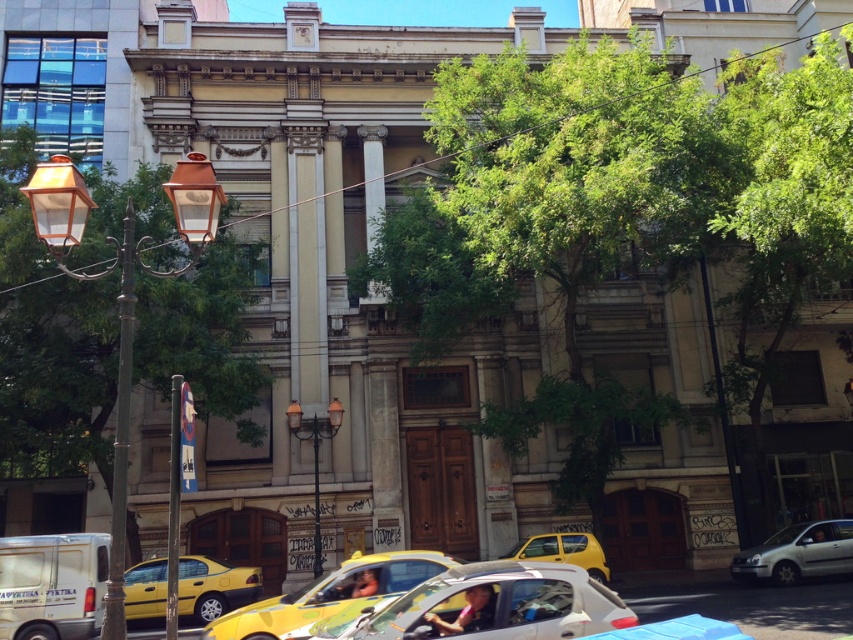
Question: Is white matte van at lower left below yellow matte taxi at lower center?

Choices:
 (A) no
 (B) yes

Answer: (A)

Question: Can you confirm if metallic silver car at center is bigger than white matte van at lower left?

Choices:
 (A) yes
 (B) no

Answer: (A)

Question: Which point is farther to the camera?

Choices:
 (A) white matte van at lower left
 (B) yellow matte taxi at center
 (C) yellow glossy taxi at center

Answer: (B)

Question: Which of the following is the farthest from the observer?

Choices:
 (A) white matte van at lower left
 (B) metallic silver car at center
 (C) yellow matte taxi at lower center

Answer: (C)

Question: Based on their relative distances, which object is nearer to the yellow matte taxi at center?

Choices:
 (A) metallic silver car at center
 (B) yellow glossy taxi at center
 (C) white matte van at lower left
 (D) white matte car at lower right

Answer: (D)

Question: Is yellow matte taxi at lower center behind white matte car at lower right?

Choices:
 (A) yes
 (B) no

Answer: (B)